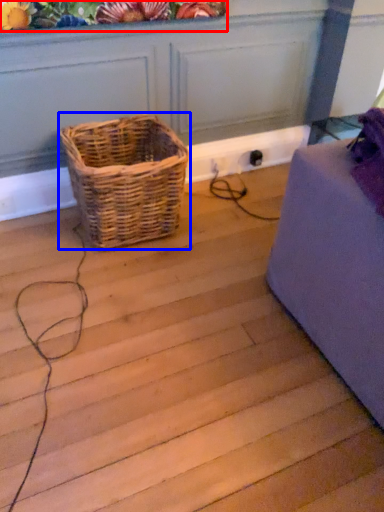
Question: Which object is further to the camera taking this photo, floral arrangement (highlighted by a red box) or picnic basket (highlighted by a blue box)?

Choices:
 (A) floral arrangement
 (B) picnic basket

Answer: (B)